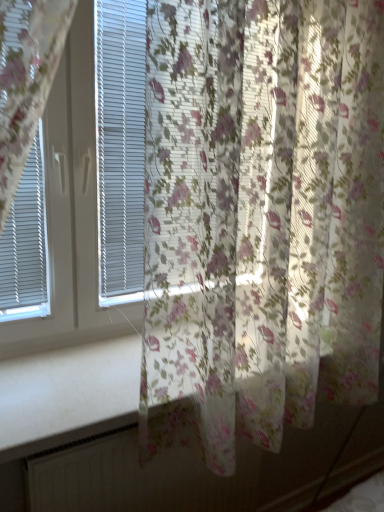
In order to click on white textured blinds at left in this screenshot , I will do `click(71, 212)`.

The height and width of the screenshot is (512, 384). Describe the element at coordinates (71, 212) in the screenshot. I see `white textured blinds at left` at that location.

What is the approximate width of white textured blinds at left?

3.41 inches.

Where is `white textured blinds at left`? white textured blinds at left is located at coordinates (71, 212).